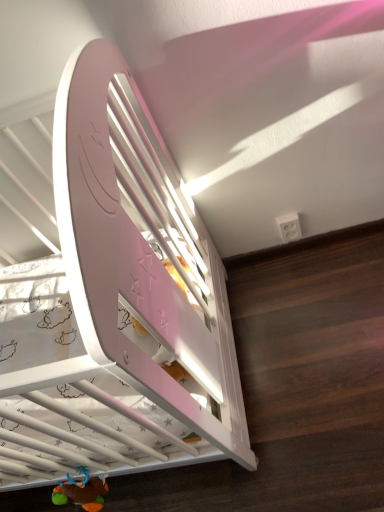
Find the location of a particular element. plush multicolored toy at lower left is located at coordinates (82, 492).

Describe the element at coordinates (82, 492) in the screenshot. I see `plush multicolored toy at lower left` at that location.

The width and height of the screenshot is (384, 512). I want to click on plush multicolored toy at lower left, so click(82, 492).